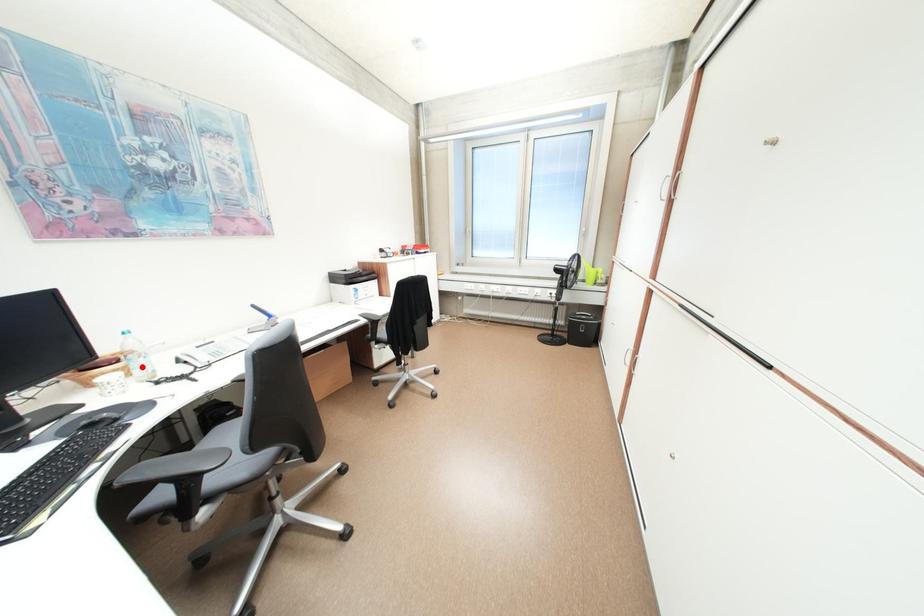
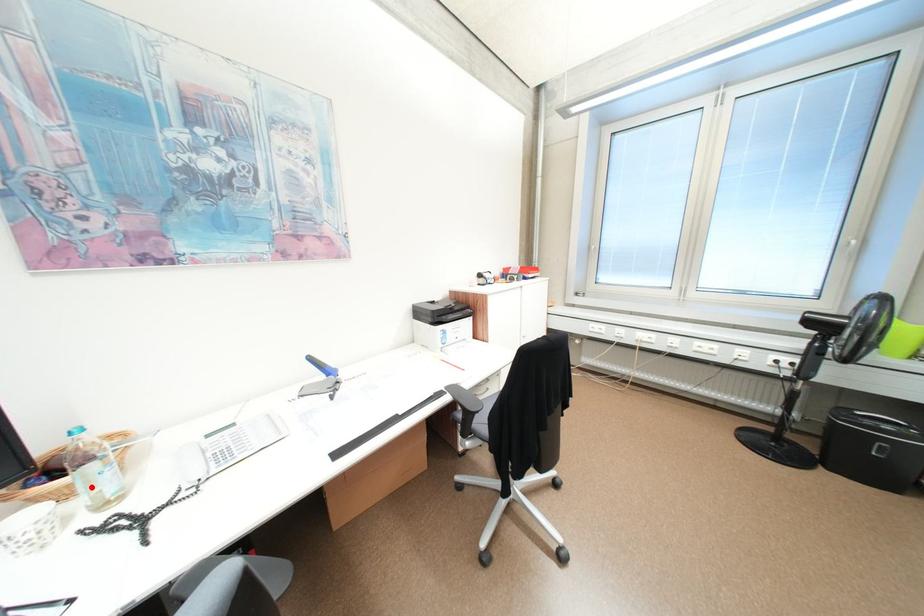
I am providing you with two images of the same scene from different viewpoints. A red point is marked on the first image and another point is marked on the second image. Are the points marked in image1 and image2 representing the same 3D position?

Yes